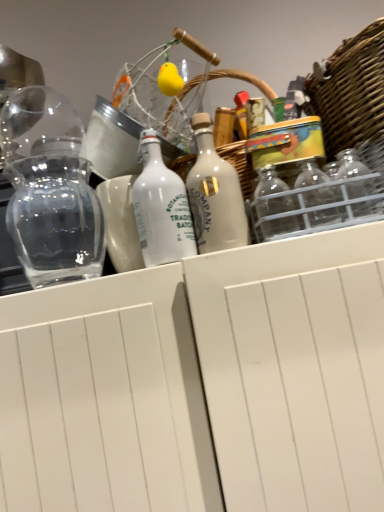
At what (x,y) coordinates should I click in order to perform the action: click on white matte bottle at center, positioned as the 2th bottle in right-to-left order. Please return your answer as a coordinate pair (x, y). This screenshot has height=512, width=384. Looking at the image, I should click on (161, 208).

Where is `white matte bottle at center, positioned as the 2th bottle in right-to-left order`? The width and height of the screenshot is (384, 512). white matte bottle at center, positioned as the 2th bottle in right-to-left order is located at coordinates (161, 208).

Is white matte bottle at center, which is the 1th bottle in left-to-right order, wider or thinner than woven wicker basket at upper right?

white matte bottle at center, which is the 1th bottle in left-to-right order, is thinner than woven wicker basket at upper right.

The width and height of the screenshot is (384, 512). Find the location of `basket above the white matte bottle at center, which is the 1th bottle in left-to-right order (from a real-world perspective)`. basket above the white matte bottle at center, which is the 1th bottle in left-to-right order (from a real-world perspective) is located at coordinates (352, 97).

Does point (148, 263) appear closer or farther from the camera than point (357, 101)?

Point (148, 263) is closer to the camera than point (357, 101).

From the picture: Is woven wicker basket at upper right at the back of white matte bottle at center, which is the 1th bottle in left-to-right order?

No, white matte bottle at center, which is the 1th bottle in left-to-right order, is not facing away from woven wicker basket at upper right.

In the scene shown: Which is more to the left, transparent glass vase at left or white matte bottle at center, placed as the 2th bottle when sorted from left to right?

transparent glass vase at left is more to the left.

From a real-world perspective, which object rests below the other?

In real-world perspective, white matte bottle at center, the first bottle viewed from the right, is lower.

Does point (50, 163) lie behind point (219, 172)?

Yes, point (50, 163) is behind point (219, 172).

The width and height of the screenshot is (384, 512). In order to click on glass jar that appears above the white matte bottle at center, placed as the 2th bottle when sorted from left to right (from the image's perspective) in this screenshot , I will do `click(55, 220)`.

Can you tell me how much woven wicker basket at upper right and white matte bottle at center, which is the 1th bottle in left-to-right order, differ in facing direction?

woven wicker basket at upper right and white matte bottle at center, which is the 1th bottle in left-to-right order, are facing 4.14 degrees away from each other.

From a real-world perspective, is woven wicker basket at upper right above or below white matte bottle at center, which is the 1th bottle in left-to-right order?

From a real-world perspective, woven wicker basket at upper right is physically above white matte bottle at center, which is the 1th bottle in left-to-right order.

Is woven wicker basket at upper right inside or outside of white matte bottle at center, which is the 1th bottle in left-to-right order?

The correct answer is: outside.

Is woven wicker basket at upper right not near white matte bottle at center, positioned as the 2th bottle in right-to-left order?

That's not correct — woven wicker basket at upper right is a little close to white matte bottle at center, positioned as the 2th bottle in right-to-left order.

Considering the points (150, 142) and (30, 222), which point is behind, point (150, 142) or point (30, 222)?

The point (30, 222) is behind.

Which of these two, white matte bottle at center, positioned as the 2th bottle in right-to-left order, or transparent glass vase at left, is bigger?

transparent glass vase at left is bigger.

Considering the sizes of white matte bottle at center, which is the 1th bottle in left-to-right order, and transparent glass vase at left in the image, is white matte bottle at center, which is the 1th bottle in left-to-right order, wider or thinner than transparent glass vase at left?

Clearly, white matte bottle at center, which is the 1th bottle in left-to-right order, has less width compared to transparent glass vase at left.

Who is shorter, white matte bottle at center, which is the 1th bottle in left-to-right order, or transparent glass vase at left?

white matte bottle at center, which is the 1th bottle in left-to-right order, is shorter.

Considering the sizes of woven wicker basket at upper right and white matte bottle at center, placed as the 2th bottle when sorted from left to right, in the image, is woven wicker basket at upper right taller or shorter than white matte bottle at center, placed as the 2th bottle when sorted from left to right,?

Considering their sizes, woven wicker basket at upper right has more height than white matte bottle at center, placed as the 2th bottle when sorted from left to right.

Is white matte bottle at center, placed as the 2th bottle when sorted from left to right, surrounded by woven wicker basket at upper right?

Definitely not — white matte bottle at center, placed as the 2th bottle when sorted from left to right, is not inside woven wicker basket at upper right.

Between point (382, 120) and point (227, 175), which one is positioned behind?

The point (227, 175) is behind.

Which object is positioned more to the left, woven wicker basket at upper right or white matte bottle at center, the first bottle viewed from the right?

Positioned to the left is white matte bottle at center, the first bottle viewed from the right.

From a real-world perspective, is woven wicker basket at upper right above or below transparent glass vase at left?

In terms of real-world spatial position, woven wicker basket at upper right is below transparent glass vase at left.

Who is smaller, woven wicker basket at upper right or transparent glass vase at left?

Smaller between the two is transparent glass vase at left.

Is woven wicker basket at upper right taller than transparent glass vase at left?

No, woven wicker basket at upper right is not taller than transparent glass vase at left.

Which is more to the right, woven wicker basket at upper right or transparent glass vase at left?

woven wicker basket at upper right is more to the right.

Considering the sizes of transparent glass vase at left and woven wicker basket at upper right in the image, is transparent glass vase at left wider or thinner than woven wicker basket at upper right?

Considering their sizes, transparent glass vase at left looks slimmer than woven wicker basket at upper right.

Based on their positions, is transparent glass vase at left located to the left or right of woven wicker basket at upper right?

transparent glass vase at left is positioned on woven wicker basket at upper right's left side.

Considering the sizes of objects transparent glass vase at left and woven wicker basket at upper right in the image provided, who is shorter, transparent glass vase at left or woven wicker basket at upper right?

Standing shorter between the two is woven wicker basket at upper right.

Is point (81, 187) farther from viewer compared to point (324, 76)?

No, it is in front of (324, 76).

You are a GUI agent. You are given a task and a screenshot of the screen. Output one action in this format:
    pyautogui.click(x=<x>, y=<y>)
    Task: Click on the basket above the white matte bottle at center, positioned as the 2th bottle in right-to-left order (from a real-world perspective)
    The width and height of the screenshot is (384, 512).
    Given the screenshot: What is the action you would take?
    pyautogui.click(x=352, y=97)

This screenshot has width=384, height=512. I want to click on the 1st bottle located beneath the transparent glass vase at left (from a real-world perspective), so click(214, 194).

Consider the image. Which object lies nearer to the anchor point transparent glass vase at left, white matte bottle at center, which is the 1th bottle in left-to-right order, or woven wicker basket at upper right?

Based on the image, white matte bottle at center, which is the 1th bottle in left-to-right order, appears to be nearer to transparent glass vase at left.

Looking at the image, which one is located further to woven wicker basket at upper right, white matte bottle at center, placed as the 2th bottle when sorted from left to right, or white matte bottle at center, positioned as the 2th bottle in right-to-left order?

The object further to woven wicker basket at upper right is white matte bottle at center, positioned as the 2th bottle in right-to-left order.

When comparing their distances from transparent glass vase at left, does white matte bottle at center, which is the 1th bottle in left-to-right order, or white matte bottle at center, placed as the 2th bottle when sorted from left to right, seem closer?

Based on the image, white matte bottle at center, which is the 1th bottle in left-to-right order, appears to be nearer to transparent glass vase at left.

Estimate the real-world distances between objects in this image. Which object is further from white matte bottle at center, the first bottle viewed from the right, white matte bottle at center, which is the 1th bottle in left-to-right order, or transparent glass vase at left?

transparent glass vase at left is positioned further to the anchor white matte bottle at center, the first bottle viewed from the right.

When comparing their distances from white matte bottle at center, placed as the 2th bottle when sorted from left to right, does transparent glass vase at left or white matte bottle at center, which is the 1th bottle in left-to-right order, seem further?

transparent glass vase at left is further to white matte bottle at center, placed as the 2th bottle when sorted from left to right.

When comparing their distances from white matte bottle at center, positioned as the 2th bottle in right-to-left order, does white matte bottle at center, placed as the 2th bottle when sorted from left to right, or woven wicker basket at upper right seem closer?

Among the two, white matte bottle at center, placed as the 2th bottle when sorted from left to right, is located nearer to white matte bottle at center, positioned as the 2th bottle in right-to-left order.

Looking at the image, which one is located further to transparent glass vase at left, white matte bottle at center, the first bottle viewed from the right, or white matte bottle at center, positioned as the 2th bottle in right-to-left order?

Based on the image, white matte bottle at center, the first bottle viewed from the right, appears to be further to transparent glass vase at left.

Considering their positions, is white matte bottle at center, placed as the 2th bottle when sorted from left to right, positioned further to transparent glass vase at left than woven wicker basket at upper right?

woven wicker basket at upper right is positioned further to the anchor transparent glass vase at left.

Find the location of `bottle between white matte bottle at center, positioned as the 2th bottle in right-to-left order, and woven wicker basket at upper right`. bottle between white matte bottle at center, positioned as the 2th bottle in right-to-left order, and woven wicker basket at upper right is located at coordinates (214, 194).

Find the location of a particular element. This screenshot has height=512, width=384. bottle situated between transparent glass vase at left and white matte bottle at center, the first bottle viewed from the right, from left to right is located at coordinates (161, 208).